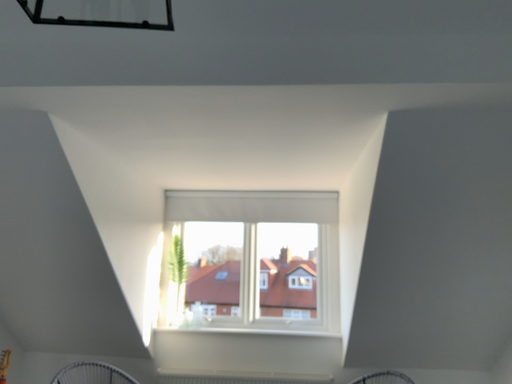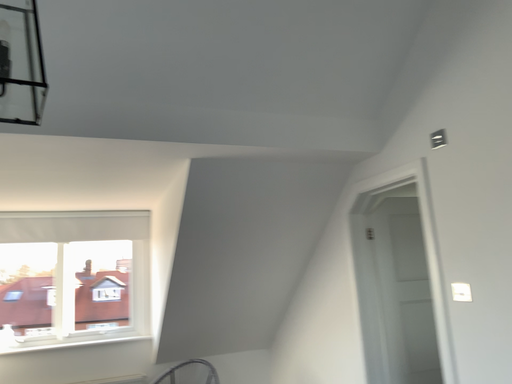
Question: How did the camera likely rotate when shooting the video?

Choices:
 (A) rotated right
 (B) rotated left

Answer: (A)